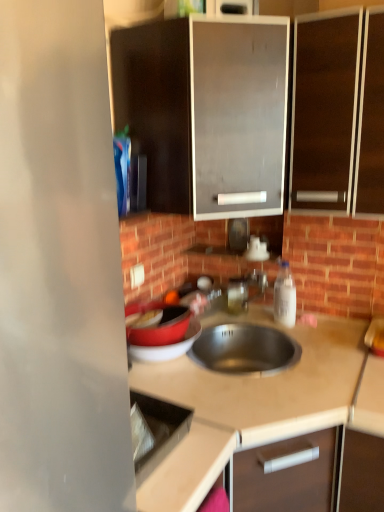
Locate an element on the screen. The width and height of the screenshot is (384, 512). free point in front of white plastic bottle at right is located at coordinates (306, 342).